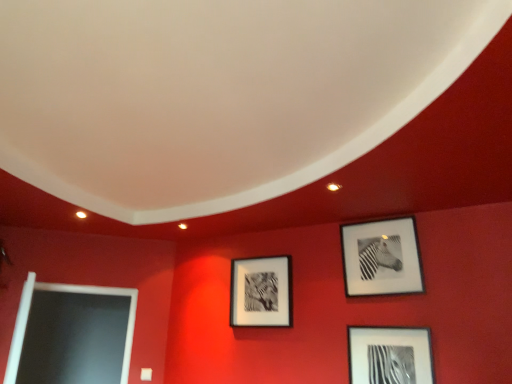
Question: Is metallic silver frame at lower right, which is the second picture frame from right to left, inside the boundaries of black matte picture frame at upper right, positioned as the first picture frame in right-to-left order, or outside?

Choices:
 (A) outside
 (B) inside

Answer: (A)

Question: Looking at the image, does metallic silver frame at lower right, which is the second picture frame from right to left, seem bigger or smaller compared to black matte picture frame at upper right, the 3th picture frame in the left-to-right sequence?

Choices:
 (A) small
 (B) big

Answer: (A)

Question: Which object is the closest to the metallic silver frame at lower right, which is the 2th picture frame in left-to-right order?

Choices:
 (A) matte black picture frame at center, the first picture frame viewed from the left
 (B) black matte picture frame at upper right, positioned as the first picture frame in right-to-left order

Answer: (B)

Question: Which object is the closest to the metallic silver frame at lower right, which is the 2th picture frame in left-to-right order?

Choices:
 (A) black matte picture frame at upper right, positioned as the first picture frame in right-to-left order
 (B) matte black picture frame at center, the first picture frame viewed from the left

Answer: (A)